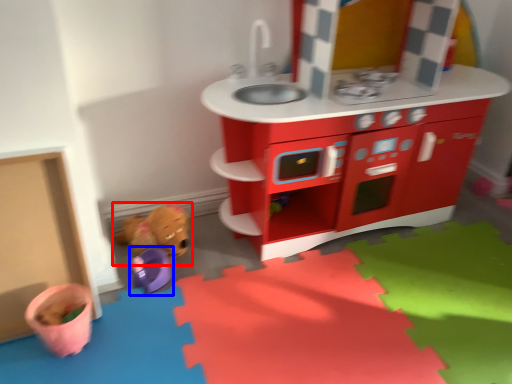
Question: Which object is further to the camera taking this photo, toy (highlighted by a red box) or toy (highlighted by a blue box)?

Choices:
 (A) toy
 (B) toy

Answer: (A)